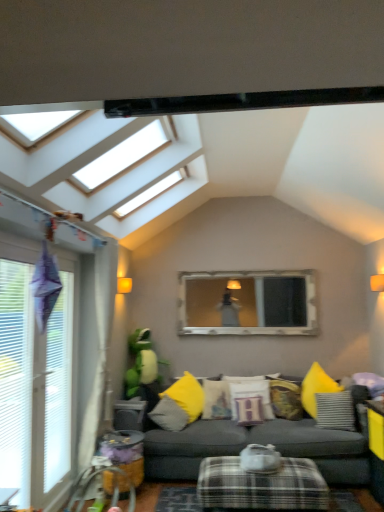
The image size is (384, 512). What are the coordinates of `matte yellow pillow at center, the second pillow in the left-to-right sequence` in the screenshot? It's located at (216, 399).

Image resolution: width=384 pixels, height=512 pixels. Find the location of `white plastic window at left`. white plastic window at left is located at coordinates (36, 381).

Find the location of a particular element. The image size is (384, 512). yellow fabric pillow at right, positioned as the first pillow in right-to-left order is located at coordinates (335, 410).

This screenshot has width=384, height=512. What do you see at coordinates (94, 344) in the screenshot?
I see `beige fabric curtain at left` at bounding box center [94, 344].

Describe the element at coordinates (259, 443) in the screenshot. I see `matte gray couch at center` at that location.

Where is `plaid fabric ottoman at lower center`? The width and height of the screenshot is (384, 512). plaid fabric ottoman at lower center is located at coordinates (261, 486).

Identify the location of matte yellow pillow at center, the fourth pillow in the right-to-left sequence. (216, 399).

Does white plastic window at left come in front of silver-framed mirror at center?

Yes, the depth of white plastic window at left is less than that of silver-framed mirror at center.

Do you think white plastic window at left is within silver-framed mirror at center, or outside of it?

white plastic window at left lies outside silver-framed mirror at center.

From their relative heights in the image, would you say white plastic window at left is taller or shorter than silver-framed mirror at center?

white plastic window at left is taller than silver-framed mirror at center.

Is white plastic window at left facing towards silver-framed mirror at center?

No, white plastic window at left is not turned towards silver-framed mirror at center.

Is matte gray couch at center at the back of white plastic window at left?

No, white plastic window at left's orientation is not away from matte gray couch at center.

From the image's perspective, which one is positioned lower, white plastic window at left or matte gray couch at center?

matte gray couch at center is shown below in the image.

Considering the sizes of white plastic window at left and matte gray couch at center in the image, is white plastic window at left wider or thinner than matte gray couch at center?

In the image, white plastic window at left appears to be more narrow than matte gray couch at center.

Considering the relative sizes of white plastic window at left and matte gray couch at center in the image provided, is white plastic window at left shorter than matte gray couch at center?

In fact, white plastic window at left may be taller than matte gray couch at center.

Which object is positioned more to the right, white plastic window at left or matte yellow pillow at center, the second pillow in the left-to-right sequence?

matte yellow pillow at center, the second pillow in the left-to-right sequence, is more to the right.

What's the angular difference between white plastic window at left and matte yellow pillow at center, the fourth pillow in the right-to-left sequence,'s facing directions?

They differ by 81 degrees in their facing directions.

Between point (68, 445) and point (220, 394), which one is positioned behind?

The point (220, 394) is farther.

Does white plastic window at left touch matte yellow pillow at center, the second pillow in the left-to-right sequence?

white plastic window at left and matte yellow pillow at center, the second pillow in the left-to-right sequence, are not in contact.

Is matte gray couch at center oriented towards yellow fabric pillow at center, which ranks as the fifth pillow in right-to-left order?

Yes, matte gray couch at center is facing yellow fabric pillow at center, which ranks as the fifth pillow in right-to-left order.

Which of these two, matte gray couch at center or yellow fabric pillow at center, which ranks as the fifth pillow in right-to-left order, stands shorter?

yellow fabric pillow at center, which ranks as the fifth pillow in right-to-left order, is shorter.

Starting from the matte gray couch at center, which pillow is the 2nd one to the left? Please provide its 2D coordinates.

[(169, 415)]

Looking at their sizes, would you say matte gray couch at center is wider or thinner than yellow fabric pillow at center, which ranks as the fifth pillow in right-to-left order?

matte gray couch at center is wider than yellow fabric pillow at center, which ranks as the fifth pillow in right-to-left order.

Does matte gray couch at center have a lesser height compared to white plastic window at left?

Yes, matte gray couch at center is shorter than white plastic window at left.

Is matte gray couch at center spatially inside white plastic window at left, or outside of it?

matte gray couch at center is located beyond the bounds of white plastic window at left.

Is matte gray couch at center turned away from white plastic window at left?

That's not correct — matte gray couch at center is not looking away from white plastic window at left.

From the image's perspective, which is above, matte gray couch at center or white plastic window at left?

From the image's view, white plastic window at left is above.

Which is more to the right, silver-framed mirror at center or textured yellow pillow at center, acting as the 2th pillow starting from the right?

textured yellow pillow at center, acting as the 2th pillow starting from the right, is more to the right.

Can you tell me how much silver-framed mirror at center and textured yellow pillow at center, acting as the 2th pillow starting from the right, differ in facing direction?

28.9 degrees separate the facing orientations of silver-framed mirror at center and textured yellow pillow at center, acting as the 2th pillow starting from the right.

From a real-world perspective, which object rests below the other?

textured yellow pillow at center, acting as the 2th pillow starting from the right.

Locate an element on the screen. This screenshot has width=384, height=512. bay window located above the textured yellow pillow at center, the 4th pillow viewed from the left (from a real-world perspective) is located at coordinates (247, 303).

From the image's perspective, does white plastic window at left appear higher than white cotton pillow at center, placed as the third pillow when sorted from right to left?

Yes, from the image's perspective, white plastic window at left is on top of white cotton pillow at center, placed as the third pillow when sorted from right to left.

Is point (41, 426) closer or farther from the camera than point (255, 408)?

Point (41, 426) is positioned closer to the camera compared to point (255, 408).

Image resolution: width=384 pixels, height=512 pixels. Identify the location of window that appears above the white cotton pillow at center, placed as the third pillow when sorted from right to left (from the image's perspective). (36, 381).

Is white plastic window at left wider than white cotton pillow at center, placed as the third pillow when sorted from right to left?

In fact, white plastic window at left might be narrower than white cotton pillow at center, placed as the third pillow when sorted from right to left.

I want to click on window that appears on the left of silver-framed mirror at center, so click(36, 381).

Identify the location of window above the matte gray couch at center (from a real-world perspective). The width and height of the screenshot is (384, 512). 36,381.

When comparing their distances from yellow fabric pillow at right, positioned as the first pillow in right-to-left order, does silver-framed mirror at center or plaid fabric ottoman at lower center seem closer?

plaid fabric ottoman at lower center.

From the image, which object appears to be farther from white cotton pillow at center, placed as the third pillow when sorted from right to left, textured yellow pillow at center, the 4th pillow viewed from the left, or beige fabric curtain at left?

beige fabric curtain at left is positioned further to the anchor white cotton pillow at center, placed as the third pillow when sorted from right to left.

Looking at the image, which one is located closer to textured yellow pillow at center, the 4th pillow viewed from the left, beige fabric curtain at left or yellow fabric pillow at right, positioned as the first pillow in right-to-left order?

yellow fabric pillow at right, positioned as the first pillow in right-to-left order.

Which object lies nearer to the anchor point plaid fabric ottoman at lower center, textured yellow pillow at center, acting as the 2th pillow starting from the right, or beige fabric curtain at left?

Among the two, textured yellow pillow at center, acting as the 2th pillow starting from the right, is located nearer to plaid fabric ottoman at lower center.

Considering their positions, is white cotton pillow at center, placed as the third pillow when sorted from right to left, positioned further to textured yellow pillow at center, the 4th pillow viewed from the left, than matte gray couch at center?

Among the two, matte gray couch at center is located further to textured yellow pillow at center, the 4th pillow viewed from the left.

Consider the image. Based on their spatial positions, is white cotton pillow at center, placed as the third pillow when sorted from left to right, or matte gray couch at center closer to yellow fabric pillow at right, acting as the fifth pillow starting from the left?

Among the two, matte gray couch at center is located nearer to yellow fabric pillow at right, acting as the fifth pillow starting from the left.

Looking at the image, which one is located closer to matte gray couch at center, plaid fabric ottoman at lower center or textured yellow pillow at center, the 4th pillow viewed from the left?

plaid fabric ottoman at lower center is positioned closer to the anchor matte gray couch at center.

Estimate the real-world distances between objects in this image. Which object is further from beige fabric curtain at left, white plastic window at left or matte gray couch at center?

Among the two, matte gray couch at center is located further to beige fabric curtain at left.

At what (x,y) coordinates should I click in order to perform the action: click on studio couch between white plastic window at left and silver-framed mirror at center along the z-axis. Please return your answer as a coordinate pair (x, y). The height and width of the screenshot is (512, 384). Looking at the image, I should click on (259, 443).

Where is `studio couch between yellow fabric pillow at center, which ranks as the fifth pillow in right-to-left order, and textured yellow pillow at center, acting as the 2th pillow starting from the right, from left to right`? studio couch between yellow fabric pillow at center, which ranks as the fifth pillow in right-to-left order, and textured yellow pillow at center, acting as the 2th pillow starting from the right, from left to right is located at coordinates (259, 443).

Image resolution: width=384 pixels, height=512 pixels. I want to click on pillow situated between yellow fabric pillow at center, which ranks as the fifth pillow in right-to-left order, and matte gray couch at center from left to right, so click(x=216, y=399).

Find the location of `table between white plastic window at left and matte yellow pillow at center, the second pillow in the left-to-right sequence, along the z-axis`. table between white plastic window at left and matte yellow pillow at center, the second pillow in the left-to-right sequence, along the z-axis is located at coordinates (261, 486).